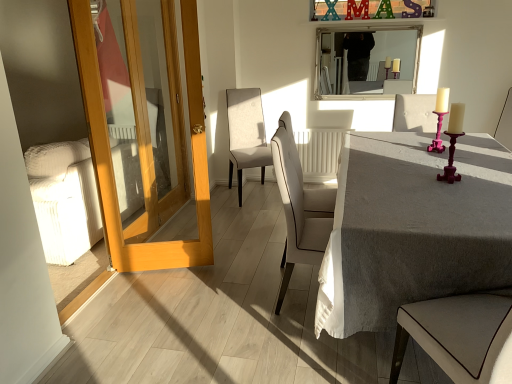
Question: In terms of width, does beige fabric chair at center, which is the third chair from right to left, look wider or thinner when compared to pink velvet chair at upper right, the second chair viewed from the back?

Choices:
 (A) wide
 (B) thin

Answer: (A)

Question: Would you say beige fabric chair at center, the 3th chair from the front, is to the left or to the right of pink velvet chair at upper right, the 2th chair when ordered from front to back, in the picture?

Choices:
 (A) left
 (B) right

Answer: (A)

Question: Estimate the real-world distances between objects in this image. Which object is farther from the pink velvet chair at upper right, the 2th chair when ordered from front to back?

Choices:
 (A) white leather chair at center, the second chair in the right-to-left sequence
 (B) silver/metallic mirror at upper center
 (C) light wood door at left
 (D) beige fabric chair at center, marked as the 1th chair in a left-to-right arrangement
 (E) gray linen table at center

Answer: (C)

Question: Which object is the farthest from the silver/metallic mirror at upper center?

Choices:
 (A) white leather chair at center, arranged as the first chair when viewed from the front
 (B) beige fabric chair at center, which is the third chair from right to left
 (C) light wood door at left
 (D) gray linen table at center
 (E) pink velvet chair at upper right, which is the 1th chair in right-to-left order

Answer: (C)